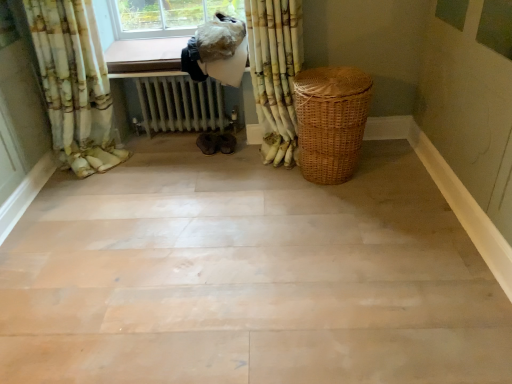
The width and height of the screenshot is (512, 384). I want to click on vacant area that lies in front of woven brown basket at right, so (x=326, y=212).